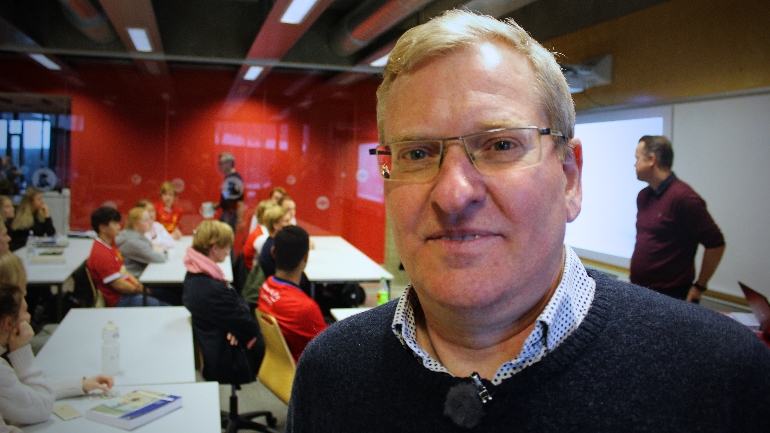
Locate an element on the screen. This screenshot has height=433, width=770. reflective glass divider wall is located at coordinates (27, 99), (136, 106), (269, 120), (360, 122), (362, 231), (215, 214), (105, 218), (15, 215), (39, 135).